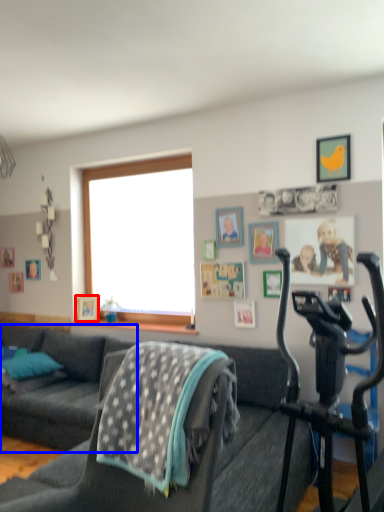
Question: Among these objects, which one is nearest to the camera, picture frame (highlighted by a red box) or studio couch (highlighted by a blue box)?

Choices:
 (A) picture frame
 (B) studio couch

Answer: (B)